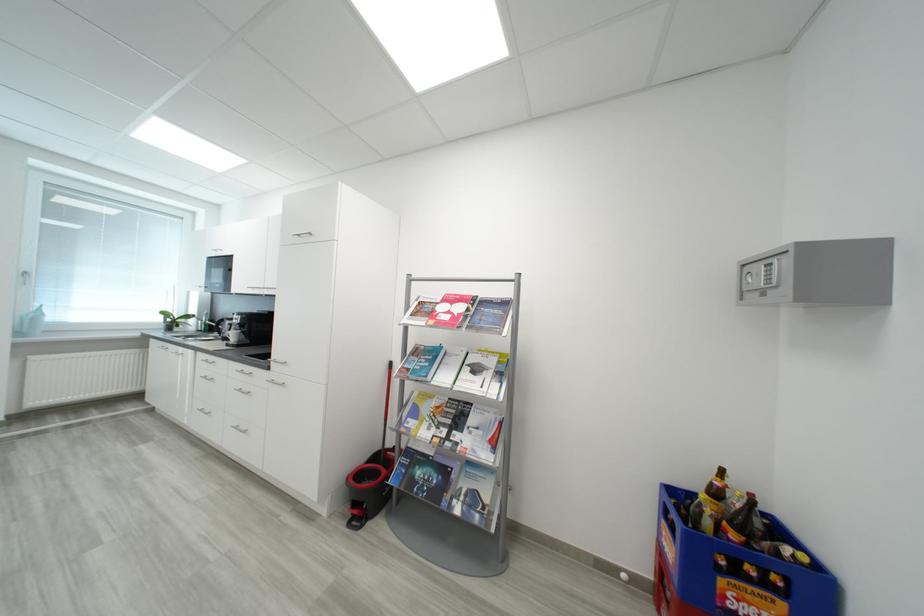
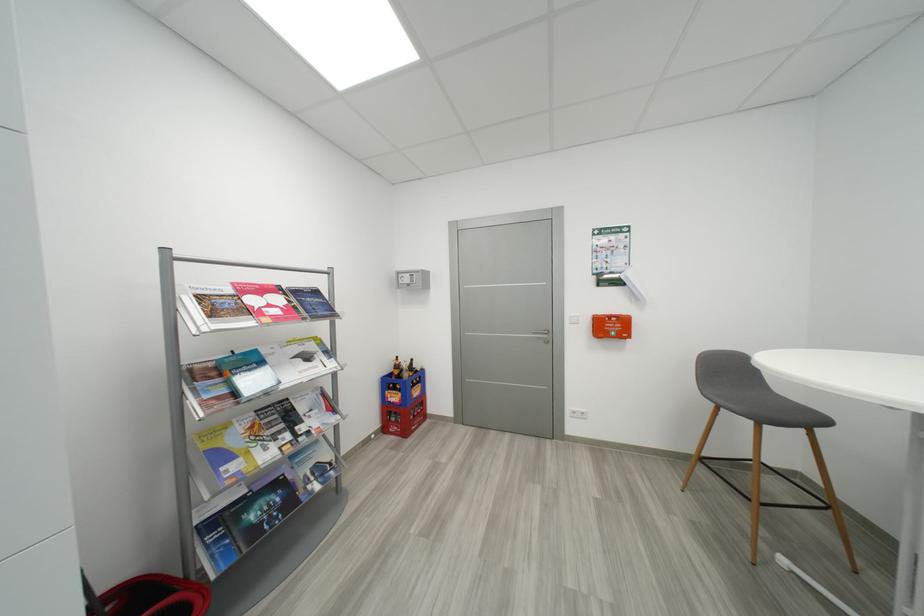
The point at (453, 472) is marked in the first image. Where is the corresponding point in the second image?

(285, 485)